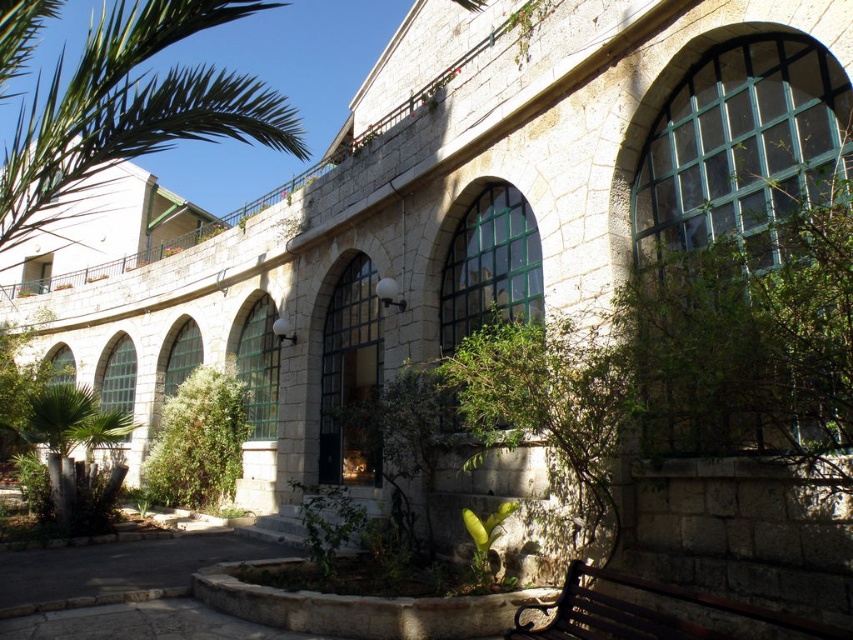
Question: Is green leafy palm at upper left positioned before dark brown wooden bench at lower right?

Choices:
 (A) yes
 (B) no

Answer: (B)

Question: Does green leafy palm at upper left lie in front of dark brown wooden bench at lower right?

Choices:
 (A) yes
 (B) no

Answer: (B)

Question: Among these points, which one is farthest from the camera?

Choices:
 (A) (9, 227)
 (B) (728, 621)

Answer: (A)

Question: Which point is closer to the camera taking this photo?

Choices:
 (A) (258, 138)
 (B) (630, 611)

Answer: (B)

Question: Is green leafy palm at upper left positioned in front of dark brown wooden bench at lower right?

Choices:
 (A) yes
 (B) no

Answer: (B)